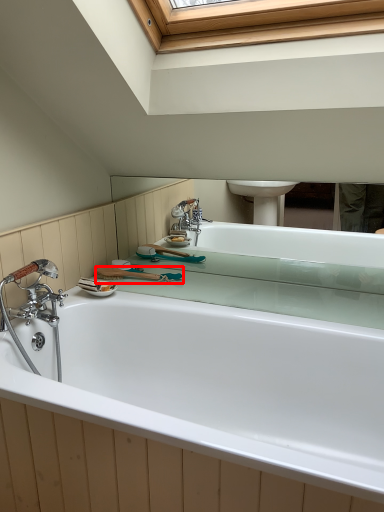
Question: In this image, where is shower (annotated by the red box) located relative to bathtub?

Choices:
 (A) left
 (B) right

Answer: (A)